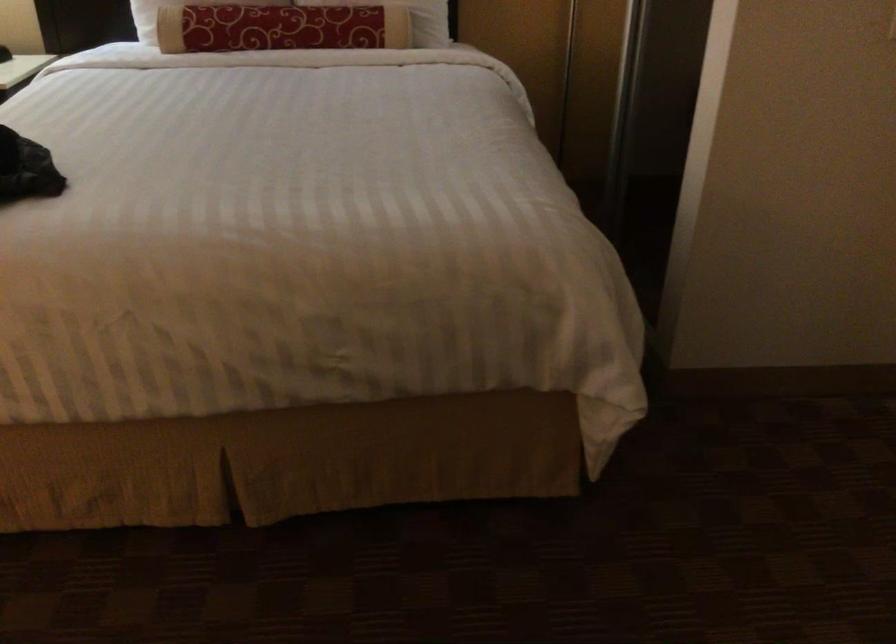
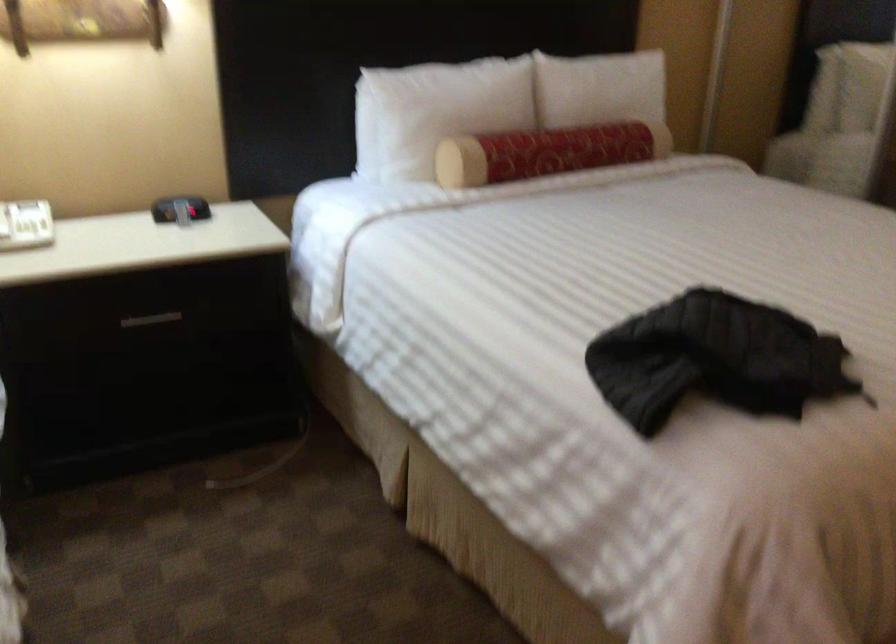
Question: What movement of the cameraman would produce the second image?

Choices:
 (A) Left
 (B) Right
 (C) Forward
 (D) Backward

Answer: (A)